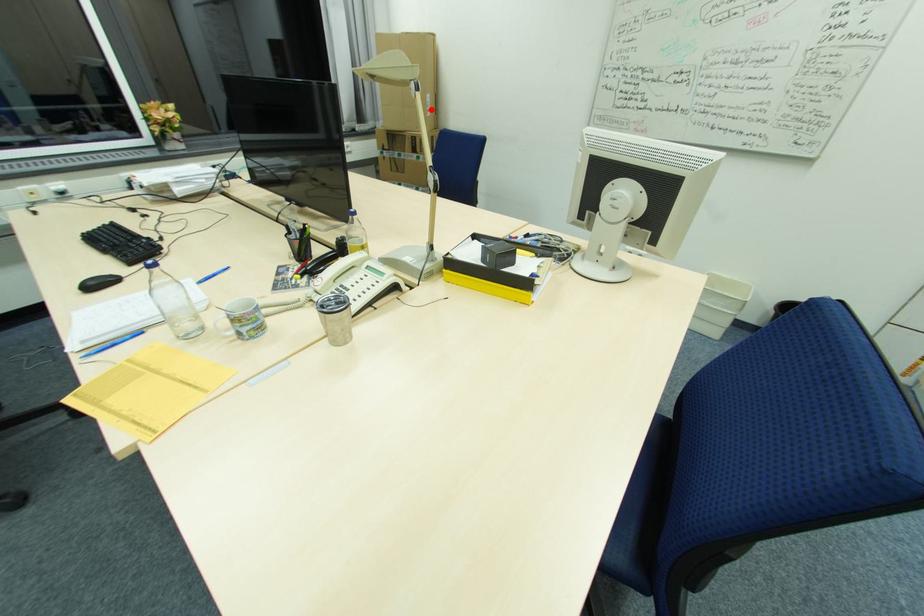
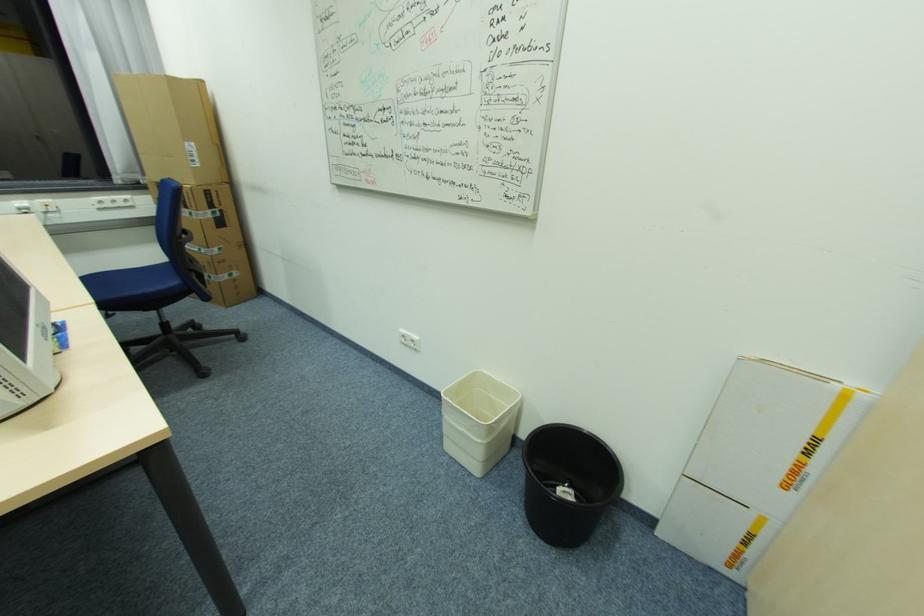
Locate, in the second image, the point that corresponds to the highlighted location in the first image.

(200, 161)